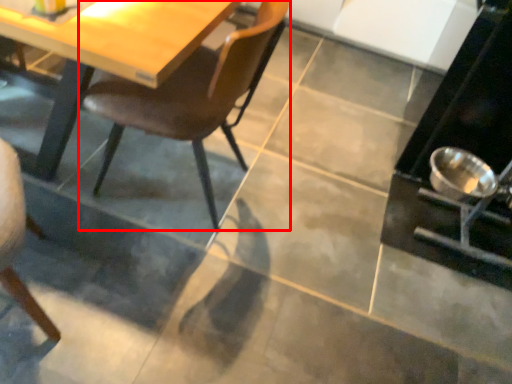
Question: From the image's perspective, where is chair (annotated by the red box) located relative to appliance?

Choices:
 (A) above
 (B) below

Answer: (B)